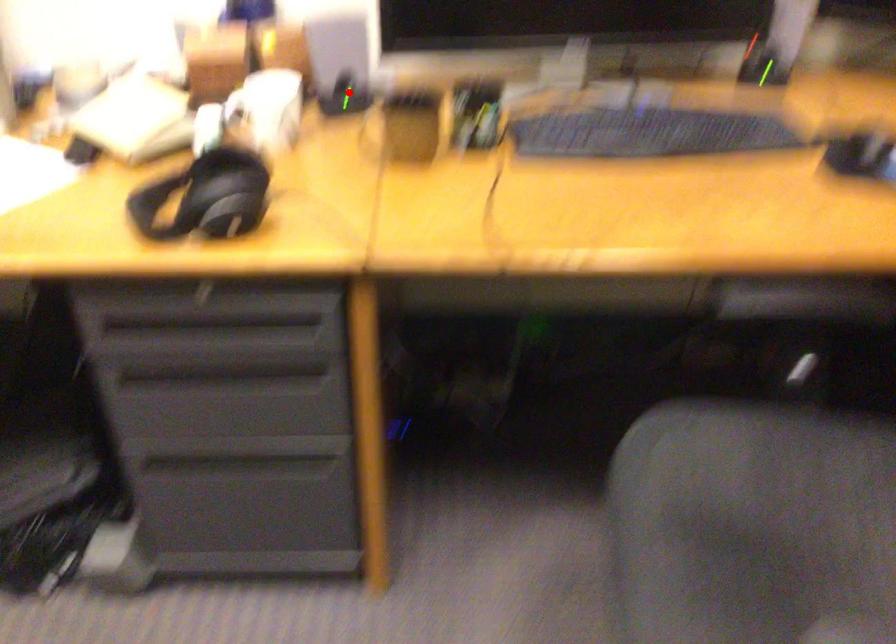
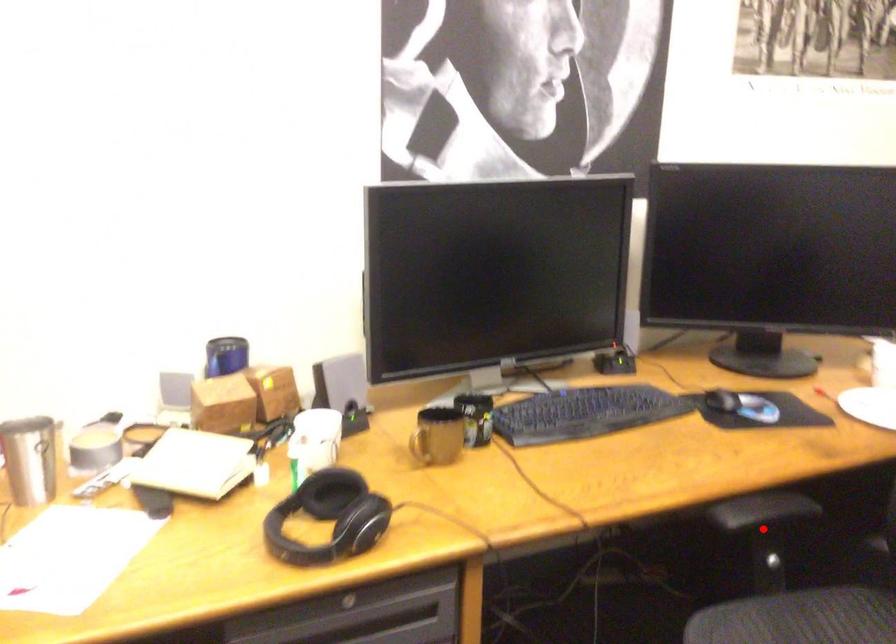
I am providing you with two images of the same scene from different viewpoints. A red point is marked on the first image and another point is marked on the second image. Do the highlighted points in image1 and image2 indicate the same real-world spot?

No